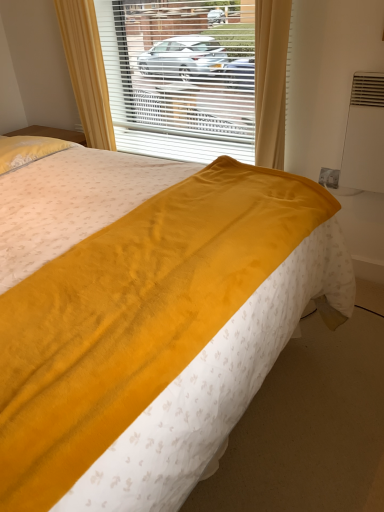
Question: From their relative heights in the image, would you say velvet yellow blanket at center is taller or shorter than white plastic blinds at center?

Choices:
 (A) tall
 (B) short

Answer: (A)

Question: In the image, is velvet yellow blanket at center positioned in front of or behind white plastic blinds at center?

Choices:
 (A) front
 (B) behind

Answer: (A)

Question: In terms of size, does velvet yellow blanket at center appear bigger or smaller than white plastic blinds at center?

Choices:
 (A) big
 (B) small

Answer: (A)

Question: Is white plastic blinds at center inside the boundaries of velvet yellow blanket at center, or outside?

Choices:
 (A) inside
 (B) outside

Answer: (B)

Question: From the image's perspective, is white plastic blinds at center located above or below velvet yellow blanket at center?

Choices:
 (A) below
 (B) above

Answer: (B)

Question: Visually, is white plastic blinds at center positioned to the left or to the right of velvet yellow blanket at center?

Choices:
 (A) right
 (B) left

Answer: (A)

Question: Does point [279, 87] appear closer or farther from the camera than point [248, 224]?

Choices:
 (A) closer
 (B) farther

Answer: (B)